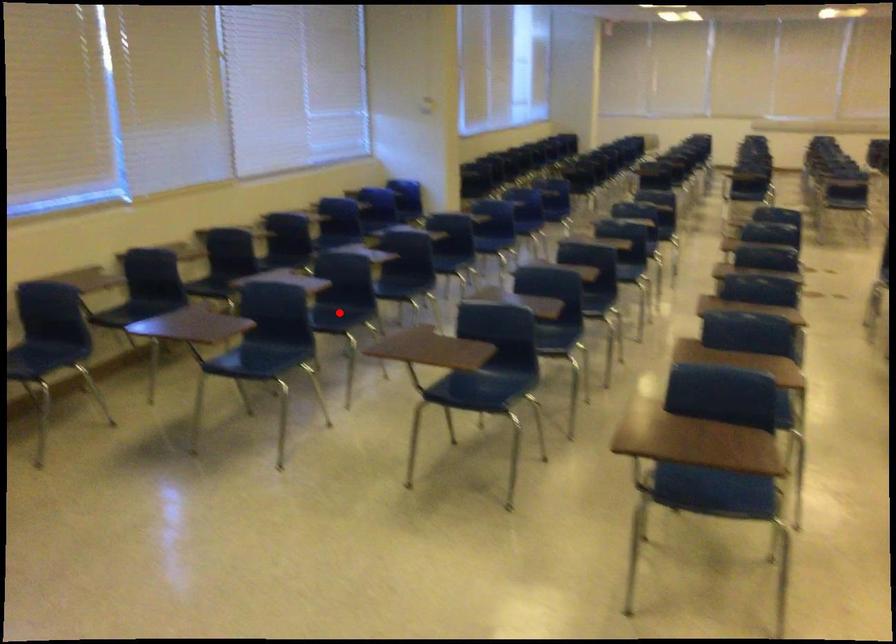
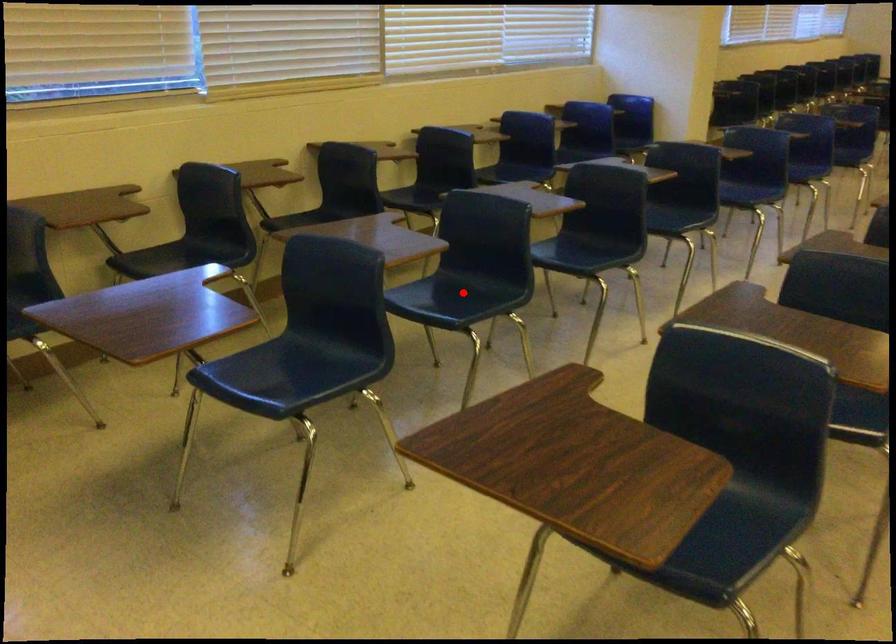
I am providing you with two images of the same scene from different viewpoints. A red point is marked on the first image and another point is marked on the second image. Does the point marked in image1 correspond to the same location as the one in image2?

Yes